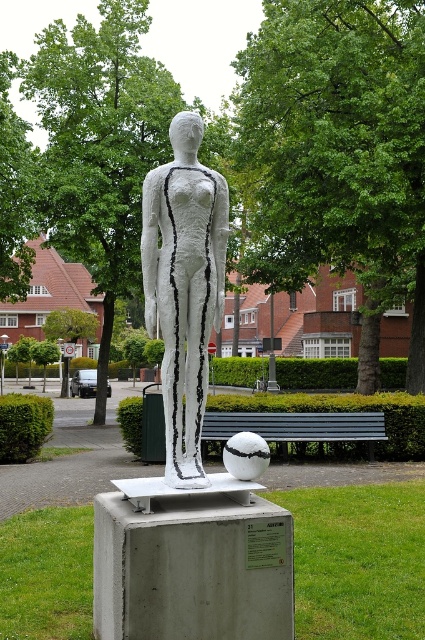
Question: Is white matte sculpture at center closer to camera compared to black wooden bench at center?

Choices:
 (A) yes
 (B) no

Answer: (A)

Question: Does white matte sculpture at center have a greater width compared to black wooden bench at center?

Choices:
 (A) yes
 (B) no

Answer: (B)

Question: Can you confirm if white matte sculpture at center is thinner than black wooden bench at center?

Choices:
 (A) no
 (B) yes

Answer: (B)